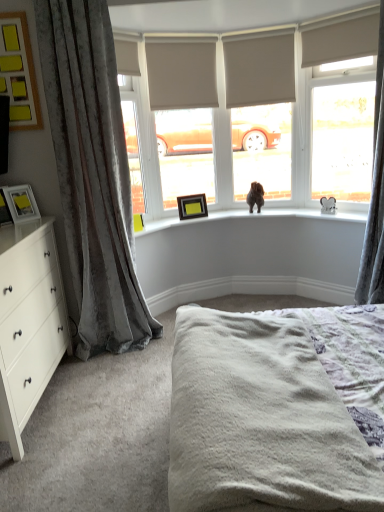
Where is `beige fabric blind at upper right, placed as the third blind when sorted from left to right`? The image size is (384, 512). beige fabric blind at upper right, placed as the third blind when sorted from left to right is located at coordinates (341, 41).

In order to face white fluffy bed at center, should I rotate leftwards or rightwards?

To face it directly, rotate right by 7.700 degrees.

This screenshot has height=512, width=384. Describe the element at coordinates (277, 410) in the screenshot. I see `white fluffy bed at center` at that location.

Identify the location of matte black picture frame at left, the second picture frame viewed from the back. (21, 203).

This screenshot has height=512, width=384. What are the coordinates of `beige fabric blind at upper center, which appears as the second blind when viewed from the left` in the screenshot? It's located at (259, 71).

In the scene shown: Which of these two, white wood chest of drawers at left or velvet gray curtain at left, the 1th curtain viewed from the left, stands shorter?

Standing shorter between the two is white wood chest of drawers at left.

Does white wood chest of drawers at left have a larger size compared to velvet gray curtain at left, the 1th curtain viewed from the left?

Correct, white wood chest of drawers at left is larger in size than velvet gray curtain at left, the 1th curtain viewed from the left.

Considering the relative positions of white wood chest of drawers at left and velvet gray curtain at left, which is the 2th curtain in right-to-left order, in the image provided, is white wood chest of drawers at left to the left of velvet gray curtain at left, which is the 2th curtain in right-to-left order, from the viewer's perspective?

Correct, you'll find white wood chest of drawers at left to the left of velvet gray curtain at left, which is the 2th curtain in right-to-left order.

The width and height of the screenshot is (384, 512). In order to click on curtain that is the 1st object located in front of the brown furry dog at center, the first animal positioned from the back in this screenshot , I will do `click(375, 198)`.

Would you say brown furry dog at center, the first animal positioned from the back, is inside or outside velvet gray curtain at right, which appears as the 1th curtain when viewed from the right?

brown furry dog at center, the first animal positioned from the back, is not inside velvet gray curtain at right, which appears as the 1th curtain when viewed from the right, it's outside.

Is point (249, 204) positioned after point (361, 291)?

Yes, it is.

Which object is positioned more to the left, brown furry dog at center, which is the 2th animal in front-to-back order, or velvet gray curtain at right, which appears as the 1th curtain when viewed from the right?

brown furry dog at center, which is the 2th animal in front-to-back order, is more to the left.

At what (x,y) coordinates should I click in order to perform the action: click on animal located on the left of white plush toy at upper right, the 1th animal from the right. Please return your answer as a coordinate pair (x, y). The width and height of the screenshot is (384, 512). Looking at the image, I should click on (255, 196).

Considering the positions of objects white plush toy at upper right, marked as the second animal in a left-to-right arrangement, and brown furry dog at center, the first animal positioned from the back, in the image provided, who is more to the right, white plush toy at upper right, marked as the second animal in a left-to-right arrangement, or brown furry dog at center, the first animal positioned from the back,?

Positioned to the right is white plush toy at upper right, marked as the second animal in a left-to-right arrangement.

Considering the points (326, 204) and (248, 194), which point is behind, point (326, 204) or point (248, 194)?

The point (248, 194) is farther.

Based on the photo, between white plush toy at upper right, placed as the 2th animal when sorted from back to front, and brown furry dog at center, placed as the second animal when sorted from right to left, which one is positioned in front?

white plush toy at upper right, placed as the 2th animal when sorted from back to front, is in front.

Is brown wooden picture frame at upper center, acting as the 1th picture frame starting from the right, in contact with white fluffy bed at center?

No, brown wooden picture frame at upper center, acting as the 1th picture frame starting from the right, is not touching white fluffy bed at center.

Is brown wooden picture frame at upper center, which ranks as the second picture frame in top-to-bottom order, further to the viewer compared to white fluffy bed at center?

Yes, it is.

Looking at this image, from the image's perspective, which one is positioned lower, brown wooden picture frame at upper center, acting as the 1th picture frame starting from the right, or white fluffy bed at center?

white fluffy bed at center is shown below in the image.

Does brown wooden picture frame at upper center, the first picture frame from the back, have a greater width compared to white fluffy bed at center?

No.

From the image's perspective, is beige fabric blind at upper center, which appears as the second blind when viewed from the right, located above or below matte black picture frame at left, which appears as the 1th picture frame when viewed from the left?

Based on their image positions, beige fabric blind at upper center, which appears as the second blind when viewed from the right, is located above matte black picture frame at left, which appears as the 1th picture frame when viewed from the left.

Which is in front, beige fabric blind at upper center, which appears as the second blind when viewed from the right, or matte black picture frame at left, placed as the 2th picture frame when sorted from front to back?

matte black picture frame at left, placed as the 2th picture frame when sorted from front to back, is in front.

Which object is wider, beige fabric blind at upper center, which appears as the second blind when viewed from the right, or matte black picture frame at left, which appears as the first picture frame when ordered from the bottom?

matte black picture frame at left, which appears as the first picture frame when ordered from the bottom.

Between point (236, 78) and point (6, 214), which one is positioned behind?

Point (236, 78)

From their relative heights in the image, would you say velvet gray curtain at left, the 1th curtain viewed from the left, is taller or shorter than matte black picture frame at left, which appears as the 1th picture frame when viewed from the left?

In the image, velvet gray curtain at left, the 1th curtain viewed from the left, appears to be taller than matte black picture frame at left, which appears as the 1th picture frame when viewed from the left.

Considering the positions of objects velvet gray curtain at left, the 1th curtain viewed from the left, and matte black picture frame at left, which appears as the first picture frame when ordered from the bottom, in the image provided, who is in front, velvet gray curtain at left, the 1th curtain viewed from the left, or matte black picture frame at left, which appears as the first picture frame when ordered from the bottom,?

velvet gray curtain at left, the 1th curtain viewed from the left.

Is velvet gray curtain at left, which is the 2th curtain in right-to-left order, smaller than matte black picture frame at left, the fourth picture frame viewed from the top?

No, velvet gray curtain at left, which is the 2th curtain in right-to-left order, is not smaller than matte black picture frame at left, the fourth picture frame viewed from the top.

Between velvet gray curtain at left, which is the 2th curtain in right-to-left order, and matte black picture frame at left, which appears as the 1th picture frame when viewed from the left, which one appears on the right side from the viewer's perspective?

Positioned to the right is velvet gray curtain at left, which is the 2th curtain in right-to-left order.

Between matte black picture frame at left, which appears as the 1th picture frame when viewed from the left, and velvet gray curtain at left, the 1th curtain viewed from the left, which one has more height?

velvet gray curtain at left, the 1th curtain viewed from the left.

Is matte black picture frame at left, which is the third picture frame in back-to-front order, bigger than velvet gray curtain at left, which is the 2th curtain in right-to-left order?

Incorrect, matte black picture frame at left, which is the third picture frame in back-to-front order, is not larger than velvet gray curtain at left, which is the 2th curtain in right-to-left order.

Is matte black picture frame at left, which appears as the first picture frame when ordered from the bottom, not within velvet gray curtain at left, the 1th curtain viewed from the left?

matte black picture frame at left, which appears as the first picture frame when ordered from the bottom, is positioned outside velvet gray curtain at left, the 1th curtain viewed from the left.

Where is `curtain that is the 1st one when counting upward from the white wood chest of drawers at left (from the image's perspective)`? The width and height of the screenshot is (384, 512). curtain that is the 1st one when counting upward from the white wood chest of drawers at left (from the image's perspective) is located at coordinates (93, 174).

Where is `the 2nd animal to the left when counting from the velvet gray curtain at right, which appears as the 1th curtain when viewed from the right`? the 2nd animal to the left when counting from the velvet gray curtain at right, which appears as the 1th curtain when viewed from the right is located at coordinates (255, 196).

Estimate the real-world distances between objects in this image. Which object is further from beige fabric blind at upper right, positioned as the first blind in right-to-left order, brown wooden picture frame at upper center, which is the 4th picture frame from front to back, or yellow matte picture frame at upper left, arranged as the 4th picture frame when ordered from the bottom?

Among the two, yellow matte picture frame at upper left, arranged as the 4th picture frame when ordered from the bottom, is located further to beige fabric blind at upper right, positioned as the first blind in right-to-left order.

Which object lies nearer to the anchor point beige fabric blind at upper right, placed as the third blind when sorted from left to right, beige fabric blind at upper center, placed as the third blind when sorted from right to left, or matte black picture frame at left, which is the third picture frame in back-to-front order?

beige fabric blind at upper center, placed as the third blind when sorted from right to left, is positioned closer to the anchor beige fabric blind at upper right, placed as the third blind when sorted from left to right.

Based on their spatial positions, is brown furry dog at center, the first animal in the left-to-right sequence, or yellow matte picture frame at upper left, marked as the 4th picture frame in a back-to-front arrangement, further from matte black picture frame at left, which is the third picture frame in back-to-front order?

brown furry dog at center, the first animal in the left-to-right sequence, lies further to matte black picture frame at left, which is the third picture frame in back-to-front order, than the other object.

Looking at this image, estimate the real-world distances between objects in this image. Which object is closer to white wood chest of drawers at left, beige fabric blind at upper center, placed as the third blind when sorted from right to left, or velvet gray curtain at right, which is the 2th curtain from left to right?

Among the two, beige fabric blind at upper center, placed as the third blind when sorted from right to left, is located nearer to white wood chest of drawers at left.

Which object lies further to the anchor point brown furry dog at center, the first animal in the left-to-right sequence, matte black picture frame at left, which appears as the 1th picture frame when viewed from the left, or white plush toy at upper right, the 1th animal from the right?

matte black picture frame at left, which appears as the 1th picture frame when viewed from the left.

Based on their spatial positions, is beige fabric blind at upper right, placed as the third blind when sorted from left to right, or yellow matte picture frame at upper left, the 1th picture frame from the front, further from matte black picture frame at left, which is the third picture frame in right-to-left order?

Among the two, beige fabric blind at upper right, placed as the third blind when sorted from left to right, is located further to matte black picture frame at left, which is the third picture frame in right-to-left order.

Based on their spatial positions, is beige fabric blind at upper center, which appears as the second blind when viewed from the right, or beige fabric blind at upper center, the first blind positioned from the left, closer to brown wooden picture frame at upper center, which ranks as the second picture frame in top-to-bottom order?

beige fabric blind at upper center, the first blind positioned from the left, is closer to brown wooden picture frame at upper center, which ranks as the second picture frame in top-to-bottom order.

Which object lies nearer to the anchor point velvet gray curtain at left, which is the 2th curtain in right-to-left order, beige fabric blind at upper right, placed as the third blind when sorted from left to right, or matte black picture frame at left, the second picture frame viewed from the left?

matte black picture frame at left, the second picture frame viewed from the left, is positioned closer to the anchor velvet gray curtain at left, which is the 2th curtain in right-to-left order.

This screenshot has width=384, height=512. In order to click on animal between beige fabric blind at upper center, the first blind positioned from the left, and white plush toy at upper right, placed as the 2th animal when sorted from back to front, in the horizontal direction in this screenshot , I will do `click(255, 196)`.

Identify the location of the chest of drawers that lies between yellow matte picture frame at upper left, marked as the 4th picture frame in a back-to-front arrangement, and white fluffy bed at center from top to bottom. This screenshot has width=384, height=512. (29, 323).

Image resolution: width=384 pixels, height=512 pixels. I want to click on picture frame between yellow matte picture frame at upper left, the 1th picture frame from the front, and beige fabric blind at upper right, placed as the third blind when sorted from left to right, in the horizontal direction, so click(192, 206).

The width and height of the screenshot is (384, 512). Identify the location of blind between matte black picture frame at left, the second picture frame viewed from the left, and brown wooden picture frame at upper center, the third picture frame from the bottom. (181, 75).